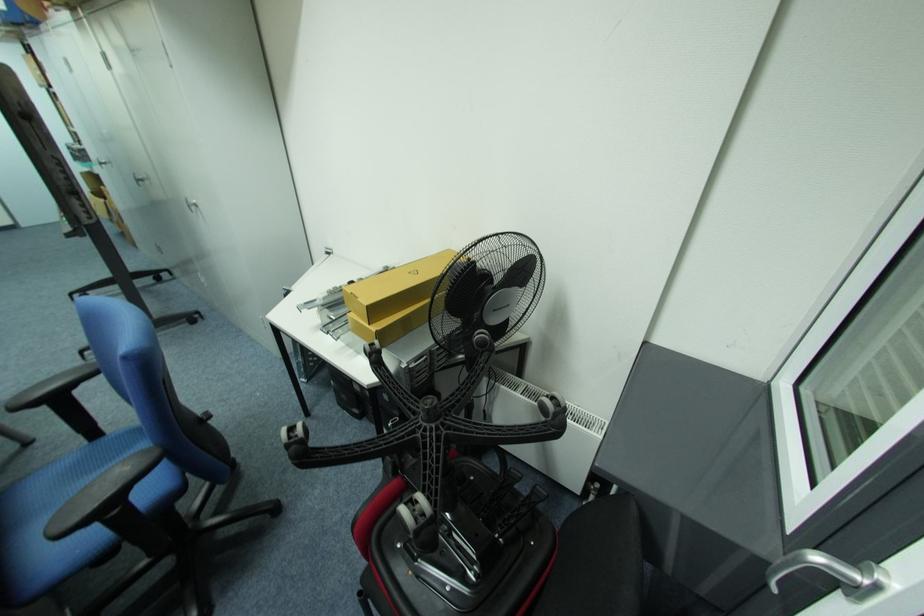
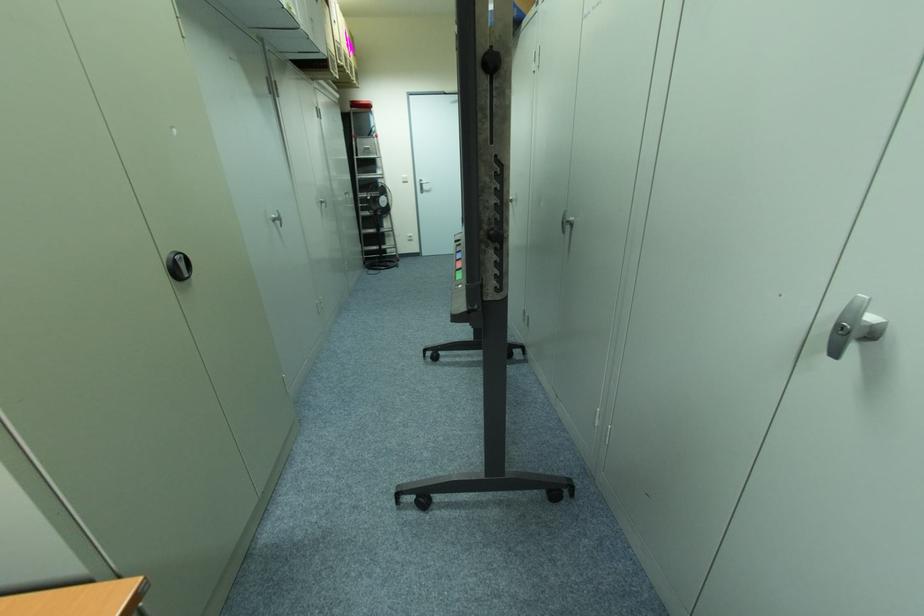
In the second image, find the point that corresponds to point (141, 179) in the first image.

(572, 219)